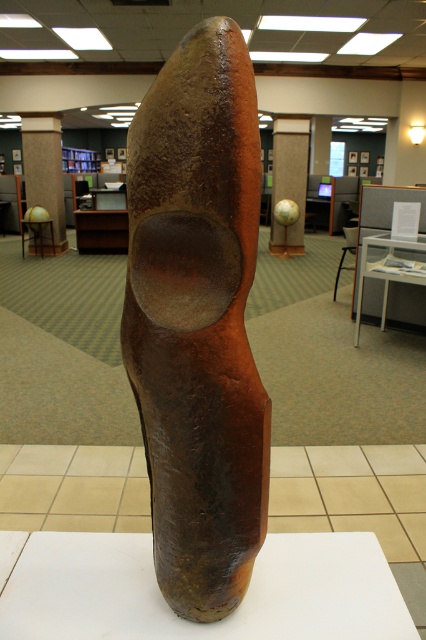
Identify the location of rusty metal sculpture at center. (198, 320).

Does rusty metal sculpture at center have a smaller size compared to matte brown globe at center?

Yes, rusty metal sculpture at center is smaller than matte brown globe at center.

The width and height of the screenshot is (426, 640). What are the coordinates of `rusty metal sculpture at center` in the screenshot? It's located at (198, 320).

Is point (129, 259) behind point (31, 122)?

No, (129, 259) is closer to viewer.

I want to click on rusty metal sculpture at center, so click(198, 320).

Can you confirm if brown textured pillar at center is shorter than matte brown globe at center?

No.

Where is `brown textured pillar at center`? This screenshot has width=426, height=640. brown textured pillar at center is located at coordinates (45, 170).

Where is `brown textured pillar at center`? The width and height of the screenshot is (426, 640). brown textured pillar at center is located at coordinates (45, 170).